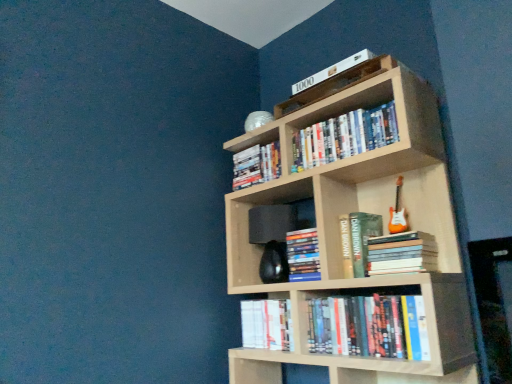
Question: Should I look upward or downward to see hardcover book at center, the sixth book positioned from the top?

Choices:
 (A) down
 (B) up

Answer: (A)

Question: Is hardcover books at upper center, which is the seventh book in bottom-to-top order, further to the viewer compared to white paper book at lower center, the first book in the bottom-to-top sequence?

Choices:
 (A) no
 (B) yes

Answer: (A)

Question: Is hardcover books at upper center, which is the seventh book in bottom-to-top order, facing away from white paper book at lower center, the first book in the bottom-to-top sequence?

Choices:
 (A) no
 (B) yes

Answer: (A)

Question: From the image's perspective, does hardcover books at upper center, which is the seventh book in bottom-to-top order, appear higher than white paper book at lower center, the first book in the bottom-to-top sequence?

Choices:
 (A) yes
 (B) no

Answer: (A)

Question: From a real-world perspective, is hardcover books at upper center, which is the seventh book in bottom-to-top order, beneath white paper book at lower center, the eighth book from the top?

Choices:
 (A) no
 (B) yes

Answer: (A)

Question: Does hardcover books at upper center, the 2th book from the top, have a lesser height compared to white paper book at lower center, the first book in the bottom-to-top sequence?

Choices:
 (A) yes
 (B) no

Answer: (A)

Question: Is hardcover books at upper center, which is the seventh book in bottom-to-top order, not near white paper book at lower center, the first book in the bottom-to-top sequence?

Choices:
 (A) yes
 (B) no

Answer: (B)

Question: Is white paper book at lower center, the first book in the bottom-to-top sequence, facing towards hardcover books at upper center, which is the seventh book in bottom-to-top order?

Choices:
 (A) yes
 (B) no

Answer: (B)

Question: Is white paper book at lower center, the first book in the bottom-to-top sequence, further to the viewer compared to hardcover books at upper center, the 2th book from the top?

Choices:
 (A) yes
 (B) no

Answer: (A)

Question: Considering the relative positions of white paper book at lower center, the eighth book from the top, and hardcover books at upper center, the 2th book from the top, in the image provided, is white paper book at lower center, the eighth book from the top, to the right of hardcover books at upper center, the 2th book from the top, from the viewer's perspective?

Choices:
 (A) yes
 (B) no

Answer: (B)

Question: Is white paper book at lower center, the eighth book from the top, taller than hardcover books at upper center, the 2th book from the top?

Choices:
 (A) no
 (B) yes

Answer: (B)

Question: Are white paper book at lower center, the first book in the bottom-to-top sequence, and hardcover books at upper center, the 2th book from the top, located far from each other?

Choices:
 (A) no
 (B) yes

Answer: (A)

Question: Is white paper book at lower center, the first book in the bottom-to-top sequence, thinner than hardcover books at upper center, the 2th book from the top?

Choices:
 (A) no
 (B) yes

Answer: (B)

Question: Can you confirm if hardcover books at lower center, which appears as the second book when ordered from the bottom, is thinner than hardcover book at center, which is the 4th book in top-to-bottom order?

Choices:
 (A) no
 (B) yes

Answer: (B)